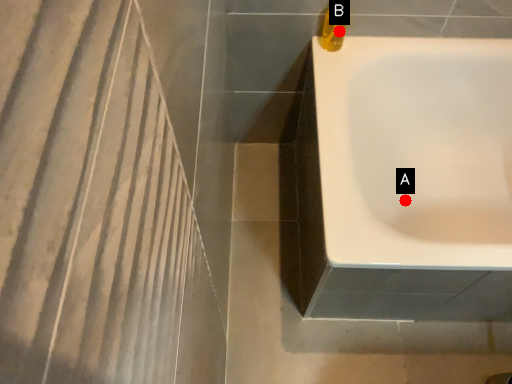
Question: Two points are circled on the image, labeled by A and B beside each circle. Which point appears farthest from the camera in this image?

Choices:
 (A) A is further
 (B) B is further

Answer: (A)